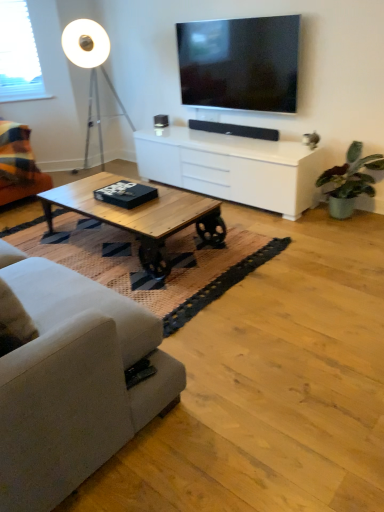
Question: From a real-world perspective, is plaid fabric couch at left, acting as the second studio couch starting from the front, on top of white glossy cabinet at center?

Choices:
 (A) no
 (B) yes

Answer: (B)

Question: Is plaid fabric couch at left, which appears as the first studio couch when viewed from the top, touching white glossy cabinet at center?

Choices:
 (A) yes
 (B) no

Answer: (B)

Question: Is plaid fabric couch at left, acting as the second studio couch starting from the front, not near white glossy cabinet at center?

Choices:
 (A) no
 (B) yes

Answer: (B)

Question: Considering the relative positions of plaid fabric couch at left, the 1th studio couch viewed from the back, and white glossy cabinet at center in the image provided, is plaid fabric couch at left, the 1th studio couch viewed from the back, to the left of white glossy cabinet at center from the viewer's perspective?

Choices:
 (A) yes
 (B) no

Answer: (A)

Question: Is plaid fabric couch at left, which is the 2th studio couch from bottom to top, positioned beyond the bounds of white glossy cabinet at center?

Choices:
 (A) no
 (B) yes

Answer: (B)

Question: Is plaid fabric couch at left, which is the 2th studio couch from bottom to top, positioned in front of white glossy cabinet at center?

Choices:
 (A) no
 (B) yes

Answer: (A)

Question: Is green matte plant at right positioned with its back to woodenmaterial/texturecoffee table at center?

Choices:
 (A) yes
 (B) no

Answer: (B)

Question: Does green matte plant at right have a lesser width compared to woodenmaterial/texturecoffee table at center?

Choices:
 (A) yes
 (B) no

Answer: (A)

Question: Does green matte plant at right have a smaller size compared to woodenmaterial/texturecoffee table at center?

Choices:
 (A) yes
 (B) no

Answer: (A)

Question: Considering the relative positions of green matte plant at right and woodenmaterial/texturecoffee table at center in the image provided, is green matte plant at right in front of woodenmaterial/texturecoffee table at center?

Choices:
 (A) yes
 (B) no

Answer: (B)

Question: Is green matte plant at right far away from woodenmaterial/texturecoffee table at center?

Choices:
 (A) no
 (B) yes

Answer: (B)

Question: Is green matte plant at right behind woodenmaterial/texturecoffee table at center?

Choices:
 (A) no
 (B) yes

Answer: (B)

Question: Is plaid fabric couch at left, which is the 2th studio couch from bottom to top, smaller than green matte plant at right?

Choices:
 (A) no
 (B) yes

Answer: (A)